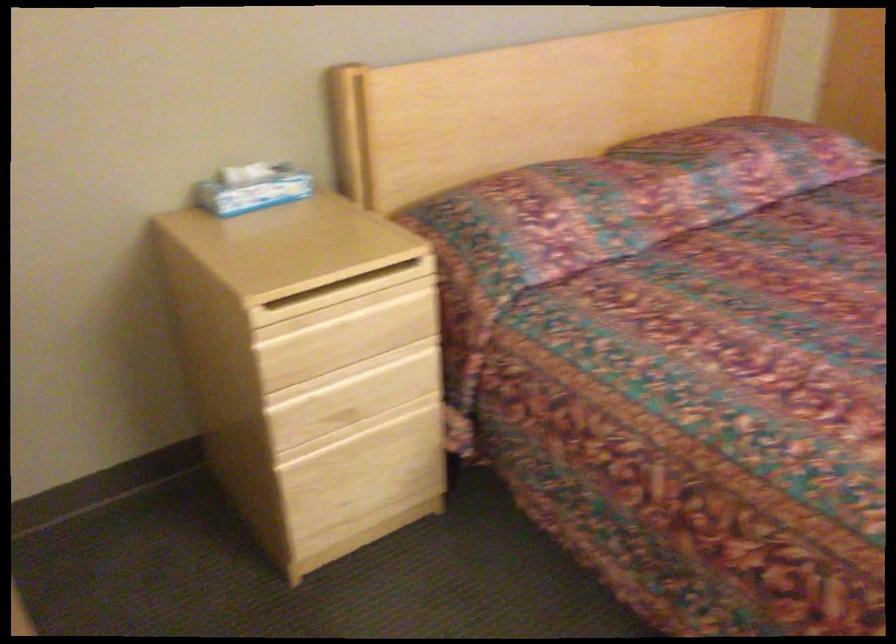
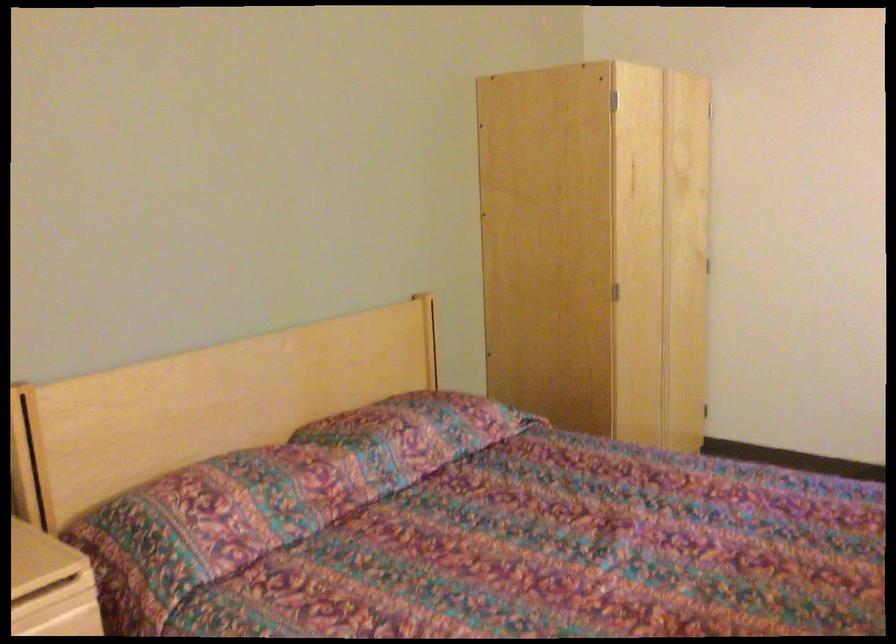
From the picture: The images are taken continuously from a first-person perspective. In which direction are you moving?

The cameraman walked toward right, backward.